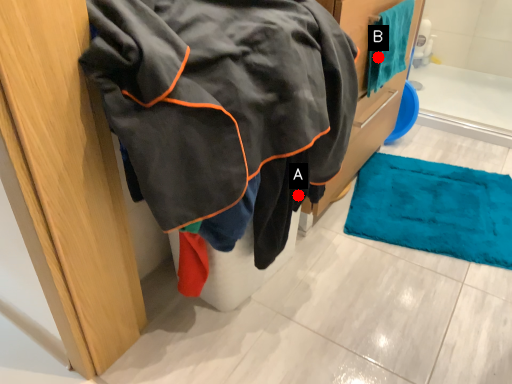
Question: Two points are circled on the image, labeled by A and B beside each circle. Which of the following is the closest to the observer?

Choices:
 (A) A is closer
 (B) B is closer

Answer: (A)